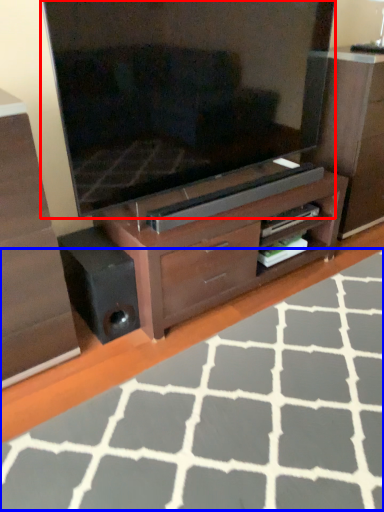
Question: Which object appears farthest to the camera in this image, television (highlighted by a red box) or plain (highlighted by a blue box)?

Choices:
 (A) television
 (B) plain

Answer: (A)